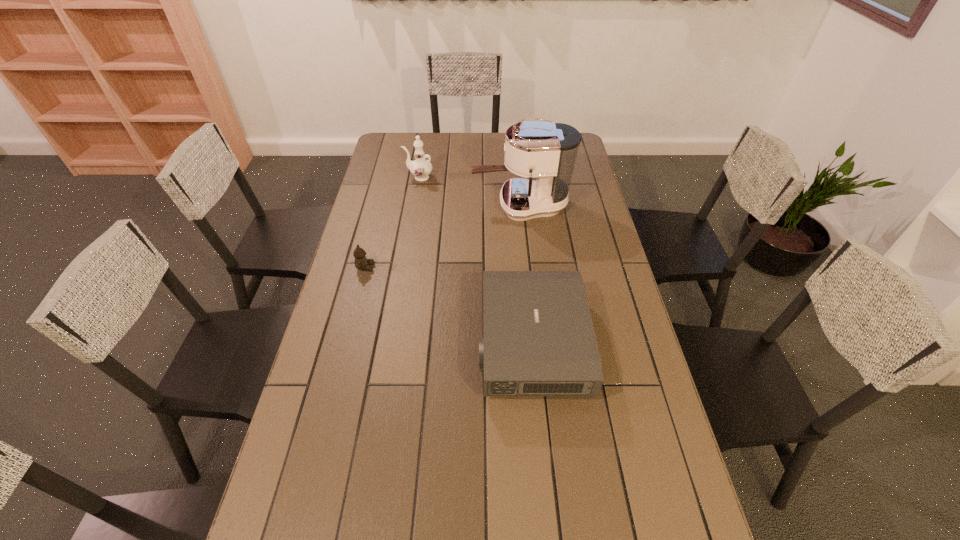
Locate an element on the screen. free space located on the front-facing side of the third nearest object is located at coordinates [397, 205].

At what (x,y) coordinates should I click in order to perform the action: click on vacant space located at the spout of the second tallest object. Please return your answer as a coordinate pair (x, y). Looking at the image, I should click on (372, 177).

Locate an element on the screen. The width and height of the screenshot is (960, 540). vacant space situated 0.080m at the spout of the second tallest object is located at coordinates (386, 177).

This screenshot has width=960, height=540. I want to click on free space located at the spout of the second tallest object, so click(388, 177).

Identify the location of free space located 0.180m on the front-facing side of the nearest object. (417, 343).

Locate an element on the screen. The height and width of the screenshot is (540, 960). free space located on the front-facing side of the nearest object is located at coordinates (448, 343).

Locate an element on the screen. The image size is (960, 540). vacant area situated 0.310m on the front-facing side of the nearest object is located at coordinates (372, 343).

Locate an element on the screen. This screenshot has width=960, height=540. vacant space situated 0.350m on the face of the leftmost object is located at coordinates (479, 267).

Identify the location of chinaware that is at the left edge. (421, 168).

The height and width of the screenshot is (540, 960). I want to click on teddy bear that is at the left edge, so click(361, 262).